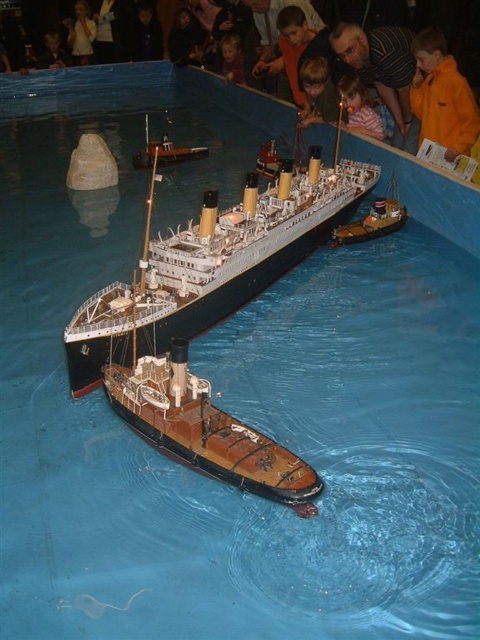
Between orange fleece jacket at upper right and smooth skin child at center, which one has less height?

Standing shorter between the two is smooth skin child at center.

Which is in front, point (421, 29) or point (228, 36)?

Positioned in front is point (421, 29).

Does point (423, 29) come farther from viewer compared to point (233, 76)?

No, it is in front of (233, 76).

At what (x,y) coordinates should I click in order to perform the action: click on orange fleece jacket at upper right. Please return your answer as a coordinate pair (x, y). Looking at the image, I should click on pyautogui.click(x=442, y=97).

Describe the element at coordinates (359, 108) in the screenshot. The image size is (480, 640). I see `smooth skin child at upper center` at that location.

Who is more forward, (x=357, y=104) or (x=240, y=44)?

Point (x=357, y=104) is more forward.

Is point (360, 131) positioned behind point (240, 49)?

No.

I want to click on smooth skin child at upper center, so click(x=359, y=108).

Is orange fleece jacket at upper right below wooden ship at center?

No, orange fleece jacket at upper right is not below wooden ship at center.

Between orange fleece jacket at upper right and wooden ship at center, which one is positioned higher?

orange fleece jacket at upper right is higher up.

Describe the element at coordinates (442, 97) in the screenshot. I see `orange fleece jacket at upper right` at that location.

The height and width of the screenshot is (640, 480). What are the coordinates of `orange fleece jacket at upper right` in the screenshot? It's located at (442, 97).